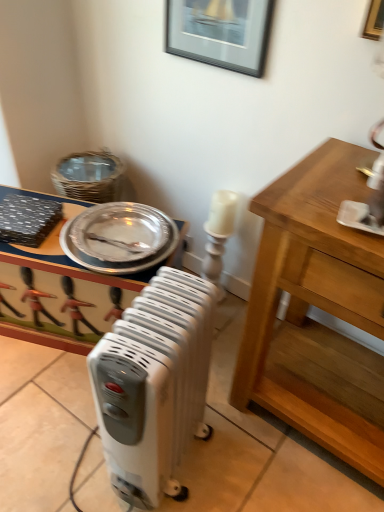
Question: Is silver metallic platter at upper left smaller than white plastic radiator at center?

Choices:
 (A) yes
 (B) no

Answer: (A)

Question: Does silver metallic platter at upper left appear on the left side of white plastic radiator at center?

Choices:
 (A) yes
 (B) no

Answer: (A)

Question: Is silver metallic platter at upper left wider than white plastic radiator at center?

Choices:
 (A) yes
 (B) no

Answer: (A)

Question: Is silver metallic platter at upper left shorter than white plastic radiator at center?

Choices:
 (A) yes
 (B) no

Answer: (A)

Question: Is silver metallic platter at upper left positioned with its back to white plastic radiator at center?

Choices:
 (A) yes
 (B) no

Answer: (B)

Question: From the image's perspective, is white plastic radiator at center located above or below metallic silver tray at center?

Choices:
 (A) above
 (B) below

Answer: (B)

Question: In terms of height, does white plastic radiator at center look taller or shorter compared to metallic silver tray at center?

Choices:
 (A) tall
 (B) short

Answer: (A)

Question: Considering the positions of point (193, 397) and point (6, 291), is point (193, 397) closer or farther from the camera than point (6, 291)?

Choices:
 (A) closer
 (B) farther

Answer: (A)

Question: Do you think white plastic radiator at center is within metallic silver tray at center, or outside of it?

Choices:
 (A) inside
 (B) outside

Answer: (B)

Question: Is white plastic radiator at center spatially inside silver metallic platter at upper left, or outside of it?

Choices:
 (A) outside
 (B) inside

Answer: (A)

Question: Looking at the image, does white plastic radiator at center seem bigger or smaller compared to silver metallic platter at upper left?

Choices:
 (A) big
 (B) small

Answer: (A)

Question: Is white plastic radiator at center taller or shorter than silver metallic platter at upper left?

Choices:
 (A) tall
 (B) short

Answer: (A)

Question: From the image's perspective, is white plastic radiator at center located above or below silver metallic platter at upper left?

Choices:
 (A) below
 (B) above

Answer: (A)

Question: Considering the positions of point (145, 224) and point (253, 29), is point (145, 224) closer or farther from the camera than point (253, 29)?

Choices:
 (A) closer
 (B) farther

Answer: (B)

Question: Looking at the image, does silver metallic platter at upper left seem bigger or smaller compared to black glossy picture frame at upper center?

Choices:
 (A) small
 (B) big

Answer: (B)